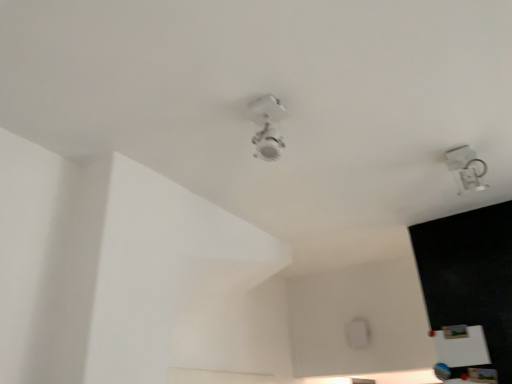
I want to click on white glossy ceiling light at center, the 2th lamp positioned from the right, so point(267,126).

What do you see at coordinates (267, 126) in the screenshot? The height and width of the screenshot is (384, 512). I see `white glossy ceiling light at center, marked as the second lamp in a back-to-front arrangement` at bounding box center [267, 126].

Image resolution: width=512 pixels, height=384 pixels. What are the coordinates of `transparent plastic lamp at upper right, which is the second lamp from front to back` in the screenshot? It's located at (466, 168).

This screenshot has width=512, height=384. What do you see at coordinates (466, 168) in the screenshot?
I see `transparent plastic lamp at upper right, which is the second lamp from front to back` at bounding box center [466, 168].

Identify the location of white glossy ceiling light at center, the first lamp when ordered from front to back. This screenshot has height=384, width=512. (267, 126).

In the image, is white glossy ceiling light at center, the 2th lamp positioned from the right, on the left side or the right side of transparent plastic lamp at upper right, positioned as the 2th lamp in left-to-right order?

white glossy ceiling light at center, the 2th lamp positioned from the right, is positioned on transparent plastic lamp at upper right, positioned as the 2th lamp in left-to-right order,'s left side.

Looking at this image, which object is more forward, white glossy ceiling light at center, the 2th lamp positioned from the right, or transparent plastic lamp at upper right, positioned as the 2th lamp in left-to-right order?

white glossy ceiling light at center, the 2th lamp positioned from the right, is closer to the camera.

Between point (262, 152) and point (466, 188), which one is positioned behind?

Positioned behind is point (466, 188).

From the image's perspective, is white glossy ceiling light at center, marked as the second lamp in a back-to-front arrangement, on top of transparent plastic lamp at upper right, positioned as the 2th lamp in left-to-right order?

Yes, from the image's perspective, white glossy ceiling light at center, marked as the second lamp in a back-to-front arrangement, is on top of transparent plastic lamp at upper right, positioned as the 2th lamp in left-to-right order.

From a real-world perspective, is white glossy ceiling light at center, the first lamp when ordered from front to back, positioned over transparent plastic lamp at upper right, arranged as the first lamp when viewed from the right, based on gravity?

Yes, from a real-world perspective, white glossy ceiling light at center, the first lamp when ordered from front to back, is on top of transparent plastic lamp at upper right, arranged as the first lamp when viewed from the right.

Looking at their sizes, would you say white glossy ceiling light at center, the first lamp when ordered from front to back, is wider or thinner than transparent plastic lamp at upper right, positioned as the 2th lamp in left-to-right order?

In the image, white glossy ceiling light at center, the first lamp when ordered from front to back, appears to be more narrow than transparent plastic lamp at upper right, positioned as the 2th lamp in left-to-right order.

Between white glossy ceiling light at center, the first lamp positioned from the left, and transparent plastic lamp at upper right, arranged as the first lamp when viewed from the right, which one has more height?

transparent plastic lamp at upper right, arranged as the first lamp when viewed from the right.

Can you confirm if white glossy ceiling light at center, the first lamp when ordered from front to back, is smaller than transparent plastic lamp at upper right, the first lamp positioned from the back?

Correct, white glossy ceiling light at center, the first lamp when ordered from front to back, occupies less space than transparent plastic lamp at upper right, the first lamp positioned from the back.

Is white glossy ceiling light at center, the first lamp positioned from the left, inside the boundaries of transparent plastic lamp at upper right, the first lamp positioned from the back, or outside?

white glossy ceiling light at center, the first lamp positioned from the left, is not inside transparent plastic lamp at upper right, the first lamp positioned from the back, it's outside.

Is there a large distance between white glossy ceiling light at center, marked as the second lamp in a back-to-front arrangement, and transparent plastic lamp at upper right, which is the second lamp from front to back?

white glossy ceiling light at center, marked as the second lamp in a back-to-front arrangement, is actually quite close to transparent plastic lamp at upper right, which is the second lamp from front to back.

Is white glossy ceiling light at center, the 2th lamp positioned from the right, oriented towards transparent plastic lamp at upper right, which is the second lamp from front to back?

No, white glossy ceiling light at center, the 2th lamp positioned from the right, does not turn towards transparent plastic lamp at upper right, which is the second lamp from front to back.

You are a GUI agent. You are given a task and a screenshot of the screen. Output one action in this format:
    pyautogui.click(x=<x>, y=<y>)
    Task: Click on the lamp below the white glossy ceiling light at center, the first lamp when ordered from front to back (from a real-world perspective)
    This screenshot has width=512, height=384.
    Given the screenshot: What is the action you would take?
    pyautogui.click(x=466, y=168)

Can you confirm if transparent plastic lamp at upper right, the first lamp positioned from the back, is positioned to the left of white glossy ceiling light at center, the first lamp positioned from the left?

No.

In the image, is transparent plastic lamp at upper right, the first lamp positioned from the back, positioned in front of or behind white glossy ceiling light at center, the first lamp when ordered from front to back?

Clearly, transparent plastic lamp at upper right, the first lamp positioned from the back, is behind white glossy ceiling light at center, the first lamp when ordered from front to back.

Is point (466, 164) farther from camera compared to point (262, 125)?

Yes.

Consider the image. From the image's perspective, would you say transparent plastic lamp at upper right, which is the second lamp from front to back, is shown under white glossy ceiling light at center, the first lamp when ordered from front to back?

Yes.

From a real-world perspective, is transparent plastic lamp at upper right, the first lamp positioned from the back, positioned under white glossy ceiling light at center, marked as the second lamp in a back-to-front arrangement, based on gravity?

Correct, in the physical world, transparent plastic lamp at upper right, the first lamp positioned from the back, is lower than white glossy ceiling light at center, marked as the second lamp in a back-to-front arrangement.

Is transparent plastic lamp at upper right, arranged as the first lamp when viewed from the right, wider than white glossy ceiling light at center, the first lamp when ordered from front to back?

Yes, transparent plastic lamp at upper right, arranged as the first lamp when viewed from the right, is wider than white glossy ceiling light at center, the first lamp when ordered from front to back.

Based on the photo, from their relative heights in the image, would you say transparent plastic lamp at upper right, the first lamp positioned from the back, is taller or shorter than white glossy ceiling light at center, the first lamp when ordered from front to back?

Clearly, transparent plastic lamp at upper right, the first lamp positioned from the back, is taller compared to white glossy ceiling light at center, the first lamp when ordered from front to back.

Considering the sizes of objects transparent plastic lamp at upper right, positioned as the 2th lamp in left-to-right order, and white glossy ceiling light at center, the first lamp positioned from the left, in the image provided, who is bigger, transparent plastic lamp at upper right, positioned as the 2th lamp in left-to-right order, or white glossy ceiling light at center, the first lamp positioned from the left,?

With larger size is transparent plastic lamp at upper right, positioned as the 2th lamp in left-to-right order.

Is transparent plastic lamp at upper right, arranged as the first lamp when viewed from the right, spatially inside white glossy ceiling light at center, the 2th lamp positioned from the right, or outside of it?

transparent plastic lamp at upper right, arranged as the first lamp when viewed from the right, lies outside white glossy ceiling light at center, the 2th lamp positioned from the right.

Are transparent plastic lamp at upper right, arranged as the first lamp when viewed from the right, and white glossy ceiling light at center, marked as the second lamp in a back-to-front arrangement, making contact?

No, transparent plastic lamp at upper right, arranged as the first lamp when viewed from the right, is not next to white glossy ceiling light at center, marked as the second lamp in a back-to-front arrangement.

Is white glossy ceiling light at center, the 2th lamp positioned from the right, at the back of transparent plastic lamp at upper right, which is the second lamp from front to back?

transparent plastic lamp at upper right, which is the second lamp from front to back, is not turned away from white glossy ceiling light at center, the 2th lamp positioned from the right.

Locate an element on the screen. The height and width of the screenshot is (384, 512). lamp above the transparent plastic lamp at upper right, the first lamp positioned from the back (from a real-world perspective) is located at coordinates (267, 126).

Find the location of a particular element. lamp located on the right of white glossy ceiling light at center, the 2th lamp positioned from the right is located at coordinates (466, 168).

At what (x,y) coordinates should I click in order to perform the action: click on lamp that is behind the white glossy ceiling light at center, the first lamp positioned from the left. Please return your answer as a coordinate pair (x, y). The height and width of the screenshot is (384, 512). Looking at the image, I should click on (466, 168).